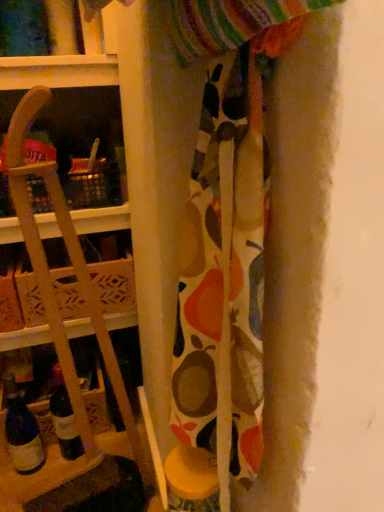
Identify the location of wooden at left. (63, 324).

This screenshot has width=384, height=512. What do you see at coordinates (63, 324) in the screenshot?
I see `wooden at left` at bounding box center [63, 324].

What do you see at coordinates (114, 284) in the screenshot?
I see `wooden crate at left` at bounding box center [114, 284].

What do you see at coordinates (222, 275) in the screenshot? I see `patterned fabric at center` at bounding box center [222, 275].

Locate an element on the screen. This screenshot has height=512, width=384. translucent glass wine bottle at lower left is located at coordinates (22, 432).

Locate an element on the screen. wine bottle below the wooden crate at left (from the image's perspective) is located at coordinates (22, 432).

Considering the positions of objects wooden crate at left and translucent glass wine bottle at lower left in the image provided, who is in front, wooden crate at left or translucent glass wine bottle at lower left?

Positioned in front is translucent glass wine bottle at lower left.

Which point is more distant from viewer, (72, 280) or (26, 119)?

The point (72, 280) is more distant.

From the image's perspective, is wooden crate at left under wooden at left?

No, from the image's perspective, wooden crate at left is not below wooden at left.

Is wooden crate at left with wooden at left?

There is a gap between wooden crate at left and wooden at left.

Is wooden at left taller than patterned fabric at center?

Correct, wooden at left is much taller as patterned fabric at center.

From the image's perspective, does wooden at left appear higher than patterned fabric at center?

No, from the image's perspective, wooden at left is not over patterned fabric at center.

You are a GUI agent. You are given a task and a screenshot of the screen. Output one action in this format:
    pyautogui.click(x=<x>, y=<y>)
    Task: Click on the shelf lying on the left of patterned fabric at center
    
    Given the screenshot: What is the action you would take?
    pyautogui.click(x=63, y=324)

Does point (47, 266) come in front of point (184, 386)?

No, (47, 266) is behind (184, 386).

Does patterned fabric at center turn towards wooden at left?

No, patterned fabric at center is not aimed at wooden at left.

Between patterned fabric at center and wooden at left, which one appears on the right side from the viewer's perspective?

From the viewer's perspective, patterned fabric at center appears more on the right side.

Can you confirm if patterned fabric at center is smaller than wooden at left?

Yes, patterned fabric at center is smaller than wooden at left.

From the image's perspective, which is above, patterned fabric at center or wooden at left?

patterned fabric at center.

The width and height of the screenshot is (384, 512). What are the coordinates of `wine bottle located underneath the patterned fabric at center (from a real-world perspective)` in the screenshot? It's located at (22, 432).

Is translucent glass wine bottle at lower left not near patterned fabric at center?

No, translucent glass wine bottle at lower left is in close proximity to patterned fabric at center.

In the image, is translucent glass wine bottle at lower left positioned in front of or behind patterned fabric at center?

translucent glass wine bottle at lower left is behind patterned fabric at center.

Considering the sizes of objects translucent glass wine bottle at lower left and patterned fabric at center in the image provided, who is wider, translucent glass wine bottle at lower left or patterned fabric at center?

With larger width is patterned fabric at center.

Locate an element on the screen. This screenshot has height=512, width=384. wine bottle below the wooden at left (from a real-world perspective) is located at coordinates (22, 432).

Can you confirm if wooden at left is wider than translucent glass wine bottle at lower left?

Yes.

Is wooden at left located outside translucent glass wine bottle at lower left?

Yes, wooden at left is located beyond the bounds of translucent glass wine bottle at lower left.

Can you confirm if patterned fabric at center is smaller than wooden crate at left?

Incorrect, patterned fabric at center is not smaller in size than wooden crate at left.

Locate an element on the screen. cardboard box located behind the patterned fabric at center is located at coordinates (114, 284).

From the image's perspective, relative to wooden crate at left, is patterned fabric at center above or below?

patterned fabric at center is situated lower than wooden crate at left in the image.

Which is closer to the camera, [252,453] or [76,314]?

Point [252,453] is closer to the camera than point [76,314].

This screenshot has height=512, width=384. I want to click on cardboard box that appears behind the translucent glass wine bottle at lower left, so click(x=114, y=284).

Locate an element on the screen. This screenshot has width=384, height=512. shelf in front of the wooden crate at left is located at coordinates (63, 324).

When comparing their distances from translucent glass wine bottle at lower left, does wooden crate at left or wooden at left seem closer?

wooden at left.

Based on their spatial positions, is wooden at left or translucent glass wine bottle at lower left closer to patterned fabric at center?

Based on the image, wooden at left appears to be nearer to patterned fabric at center.

When comparing their distances from wooden at left, does patterned fabric at center or translucent glass wine bottle at lower left seem further?

The object further to wooden at left is patterned fabric at center.

From the image, which object appears to be nearer to patterned fabric at center, wooden crate at left or wooden at left?

wooden at left.

Estimate the real-world distances between objects in this image. Which object is further from translucent glass wine bottle at lower left, wooden at left or wooden crate at left?

wooden crate at left is further to translucent glass wine bottle at lower left.

In the scene shown: When comparing their distances from wooden crate at left, does translucent glass wine bottle at lower left or patterned fabric at center seem closer?

The object closer to wooden crate at left is translucent glass wine bottle at lower left.

Based on the photo, when comparing their distances from wooden crate at left, does wooden at left or patterned fabric at center seem closer?

The object closer to wooden crate at left is wooden at left.

Considering their positions, is wooden at left positioned further to translucent glass wine bottle at lower left than patterned fabric at center?

Based on the image, patterned fabric at center appears to be further to translucent glass wine bottle at lower left.

Find the location of `wine bottle between patterned fabric at center and wooden crate at left along the z-axis`. wine bottle between patterned fabric at center and wooden crate at left along the z-axis is located at coordinates (22, 432).

The width and height of the screenshot is (384, 512). What are the coordinates of `shelf located between patterned fabric at center and translucent glass wine bottle at lower left in the depth direction` in the screenshot? It's located at (63, 324).

Where is `shelf between patterned fabric at center and wooden crate at left along the z-axis`? shelf between patterned fabric at center and wooden crate at left along the z-axis is located at coordinates (63, 324).

Locate an element on the screen. The width and height of the screenshot is (384, 512). wine bottle between wooden at left and wooden crate at left along the z-axis is located at coordinates (22, 432).